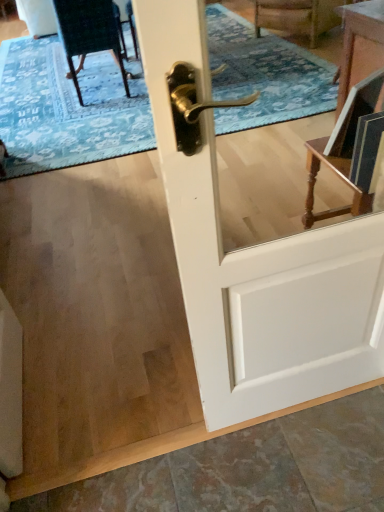
Question: From a real-world perspective, is white glossy door at center physically above blue textured rug at upper center?

Choices:
 (A) yes
 (B) no

Answer: (A)

Question: Could blue textured rug at upper center be considered to be inside white glossy door at center?

Choices:
 (A) no
 (B) yes

Answer: (A)

Question: From the image's perspective, is white glossy door at center located beneath blue textured rug at upper center?

Choices:
 (A) yes
 (B) no

Answer: (A)

Question: Can you confirm if white glossy door at center is thinner than blue textured rug at upper center?

Choices:
 (A) yes
 (B) no

Answer: (A)

Question: From the image's perspective, is white glossy door at center on top of blue textured rug at upper center?

Choices:
 (A) yes
 (B) no

Answer: (B)

Question: Is white glossy door at center to the left or to the right of velvet dark green chair at upper left in the image?

Choices:
 (A) right
 (B) left

Answer: (A)

Question: From the image's perspective, relative to velvet dark green chair at upper left, is white glossy door at center above or below?

Choices:
 (A) above
 (B) below

Answer: (B)

Question: Is point (327, 376) closer or farther from the camera than point (99, 6)?

Choices:
 (A) closer
 (B) farther

Answer: (A)

Question: Would you say white glossy door at center is inside or outside velvet dark green chair at upper left?

Choices:
 (A) outside
 (B) inside

Answer: (A)

Question: In the image, is velvet dark green chair at upper left positioned in front of or behind white glossy door at center?

Choices:
 (A) behind
 (B) front

Answer: (A)

Question: In terms of width, does velvet dark green chair at upper left look wider or thinner when compared to white glossy door at center?

Choices:
 (A) wide
 (B) thin

Answer: (A)

Question: Based on their positions, is velvet dark green chair at upper left located to the left or right of white glossy door at center?

Choices:
 (A) left
 (B) right

Answer: (A)

Question: Which is correct: velvet dark green chair at upper left is inside white glossy door at center, or outside of it?

Choices:
 (A) inside
 (B) outside

Answer: (B)

Question: In the image, is velvet dark green chair at upper left positioned in front of or behind blue textured rug at upper center?

Choices:
 (A) front
 (B) behind

Answer: (B)

Question: Is velvet dark green chair at upper left to the left or to the right of blue textured rug at upper center in the image?

Choices:
 (A) right
 (B) left

Answer: (B)